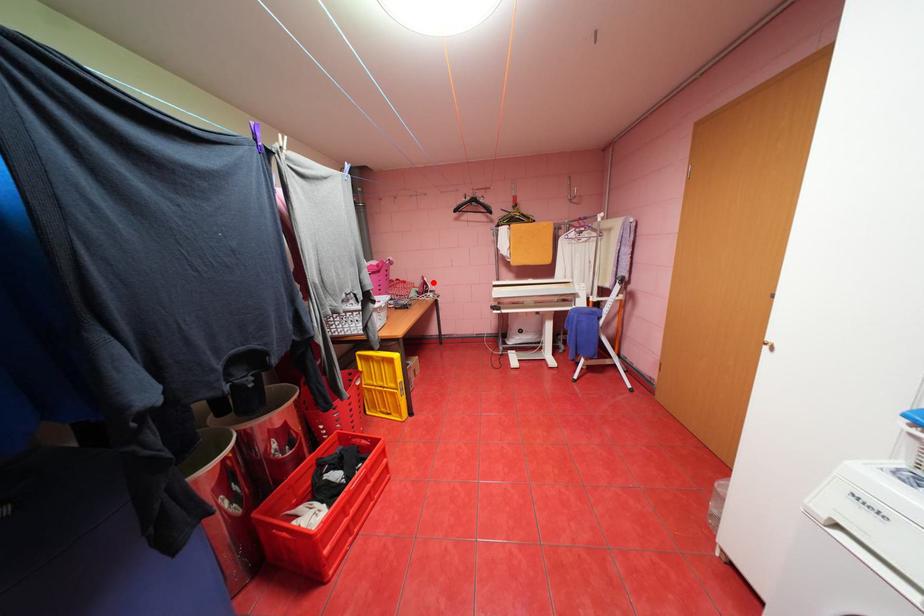
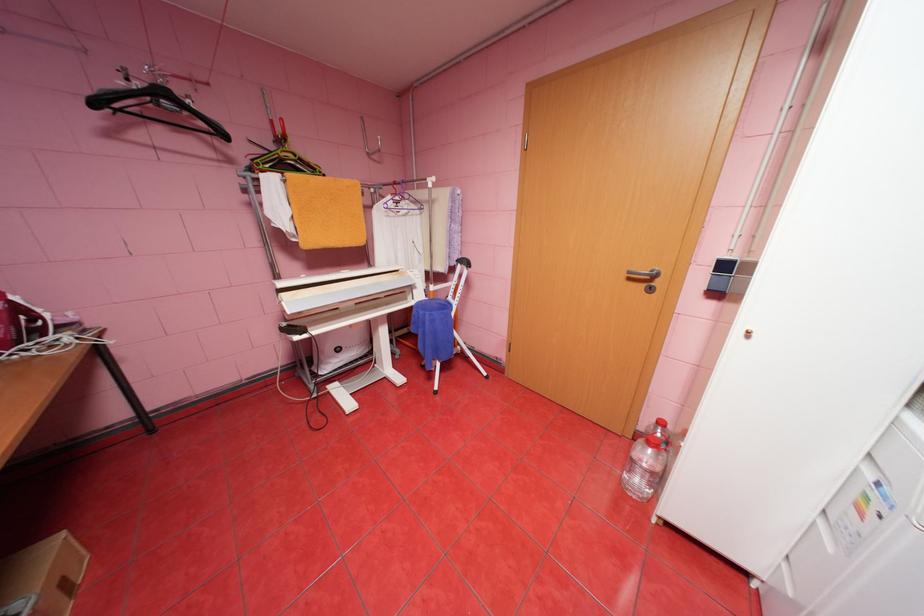
Question: I am providing you with two images of the same scene from different viewpoints. Given a red point in image1, look at the same physical point in image2. Is it:

Choices:
 (A) Closer to the viewpoint
 (B) Farther from the viewpoint

Answer: (B)